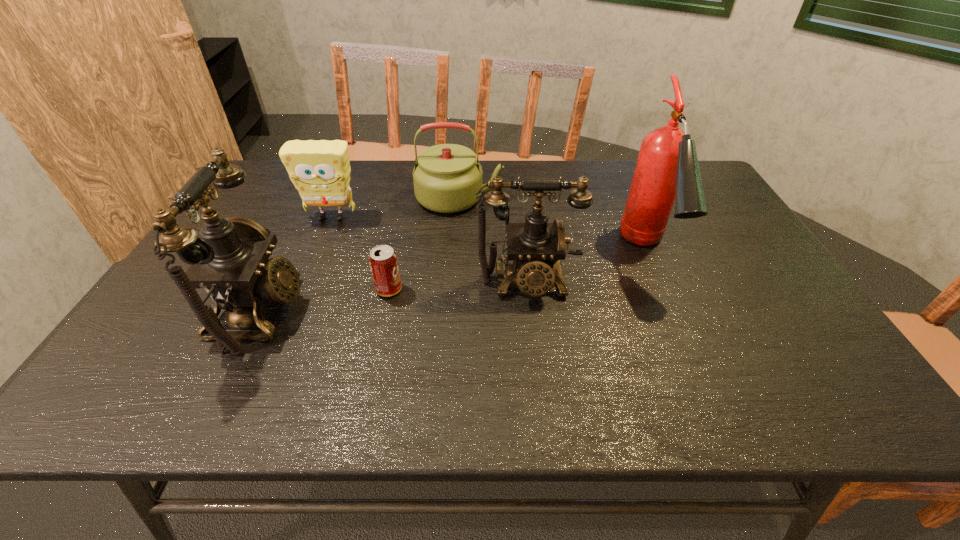
Observe the arrangement of all telephones in the image. To keep them evenly spaced, where would you place another telephone on the right? Please locate a free space. Please provide its 2D coordinates. Your answer should be formatted as a tuple, i.e. [(x, y)], where the tuple contains the x and y coordinates of a point satisfying the conditions above.

[(762, 258)]